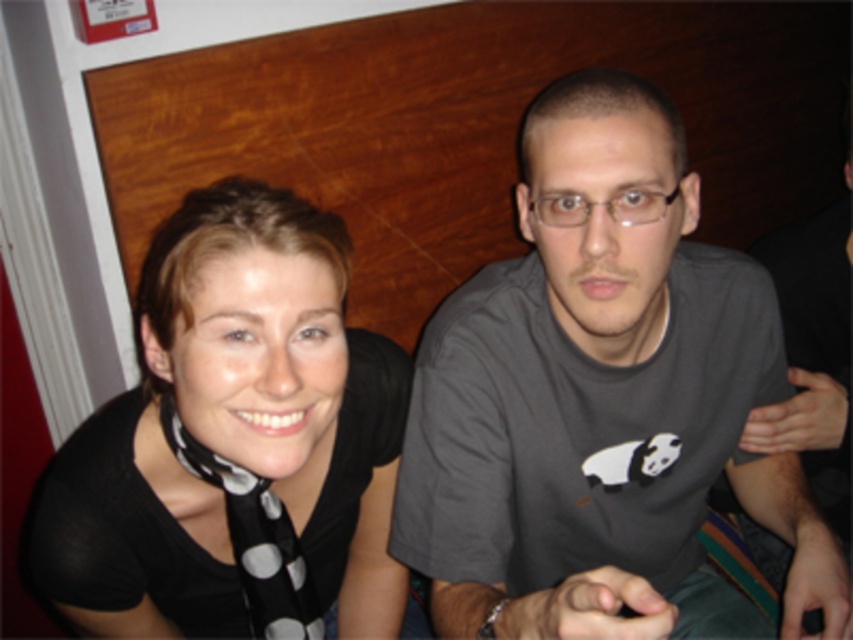
Looking at this image, who is higher up, gray matte t-shirt at center or black dotted scarf at left?

gray matte t-shirt at center is above.

Describe the element at coordinates (601, 401) in the screenshot. I see `gray matte t-shirt at center` at that location.

Is point (576, 634) closer to viewer compared to point (344, 436)?

Yes, it is in front of point (344, 436).

Where is `gray matte t-shirt at center`? gray matte t-shirt at center is located at coordinates (601, 401).